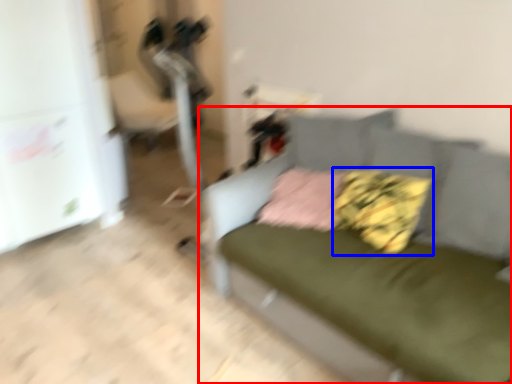
Question: Which object appears closest to the camera in this image, studio couch (highlighted by a red box) or pillow (highlighted by a blue box)?

Choices:
 (A) studio couch
 (B) pillow

Answer: (A)